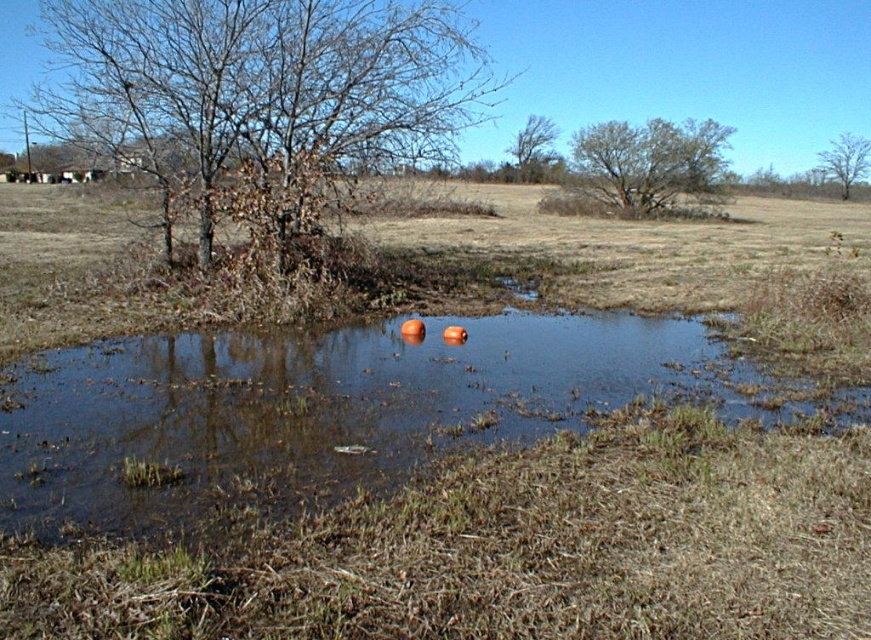
You are standing at the edge of the pond and want to place a small floating decoration exactly at the center of the translucent water at center. According to the coordinates provided, what are the coordinates where you should place the decoration?

The coordinates for the center of the translucent water at center are exactly at point (325, 406), so you should place the decoration at those coordinates.

You are a bird flying over the rural landscape and want to land near the translucent water at center. Which direction should you fly from the bare wood tree at upper right to reach the water?

The translucent water at center is located below the bare wood tree at upper right, so you should fly downward from the bare wood tree at upper right to reach the water.

You are standing at the edge of the pond and want to take a photo that includes both point (73, 403) and point (709, 176). Since you want the closer point to be in focus, which point should you focus on?

Point (73, 403) is closer to the camera than point (709, 176), so you should focus on point (73, 403) to ensure it is in focus.